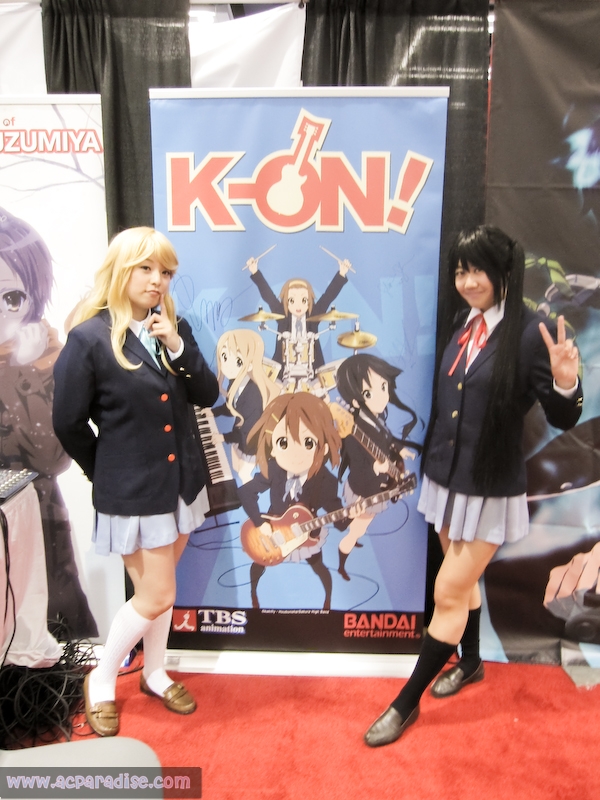
I want to click on black curtains, so click(x=81, y=58), click(x=336, y=46).